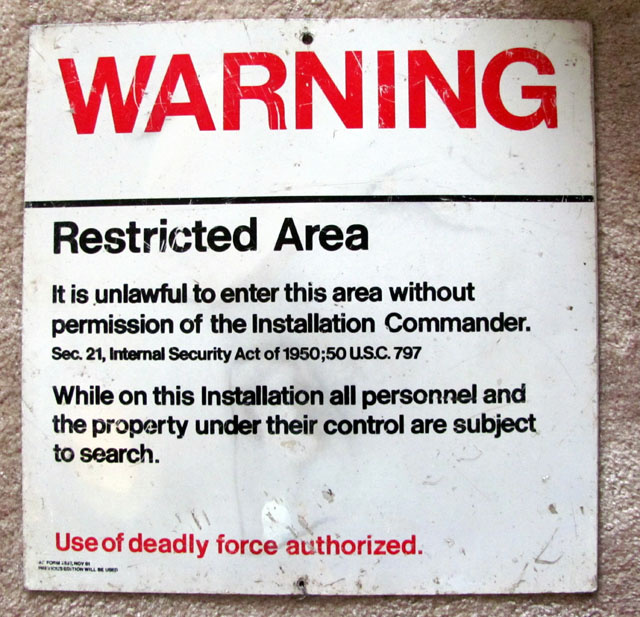
The image size is (640, 617). Find the location of `carpet space to the bottom of sign`. carpet space to the bottom of sign is located at coordinates (243, 607).